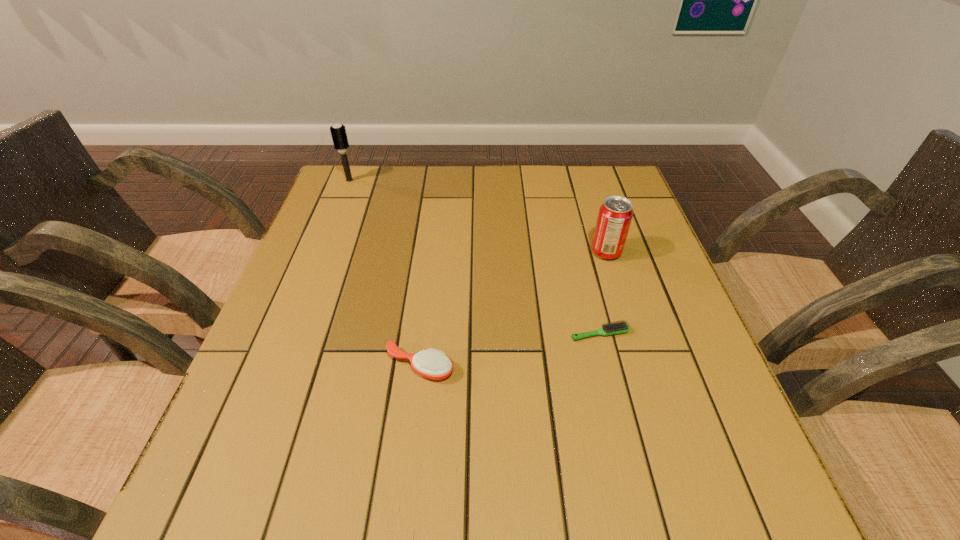
You are a GUI agent. You are given a task and a screenshot of the screen. Output one action in this format:
    pyautogui.click(x=<x>, y=<y>)
    Task: Click on the blank space at the right edge of the desktop
    This screenshot has width=960, height=540.
    Given the screenshot: What is the action you would take?
    tap(669, 345)

This screenshot has height=540, width=960. Find the location of `vacant space at the far left corner of the desktop`. vacant space at the far left corner of the desktop is located at coordinates (377, 192).

In the image, there is a desktop. Where is `vacant space at the near left corner`? vacant space at the near left corner is located at coordinates (224, 512).

Where is `vacant area at the far right corner of the desktop`? The height and width of the screenshot is (540, 960). vacant area at the far right corner of the desktop is located at coordinates (623, 182).

I want to click on free space that is in between the farthest hairbrush and the third nearest object, so click(x=478, y=216).

I want to click on vacant space that is in between the leftmost hairbrush and the shortest hairbrush, so (474, 257).

Image resolution: width=960 pixels, height=540 pixels. I want to click on free point between the leftmost object and the soda, so click(478, 216).

Identify the location of free space between the shortest object and the third tallest object. This screenshot has width=960, height=540. (510, 349).

Find the location of a particular element. This screenshot has height=540, width=960. vacant space that's between the rightmost hairbrush and the soda is located at coordinates (603, 293).

You are a GUI agent. You are given a task and a screenshot of the screen. Output one action in this format:
    pyautogui.click(x=<x>, y=<y>)
    Task: Click on the vacant region between the third nearest object and the third object from right to left
    The image size is (960, 540).
    Given the screenshot: What is the action you would take?
    pyautogui.click(x=513, y=309)